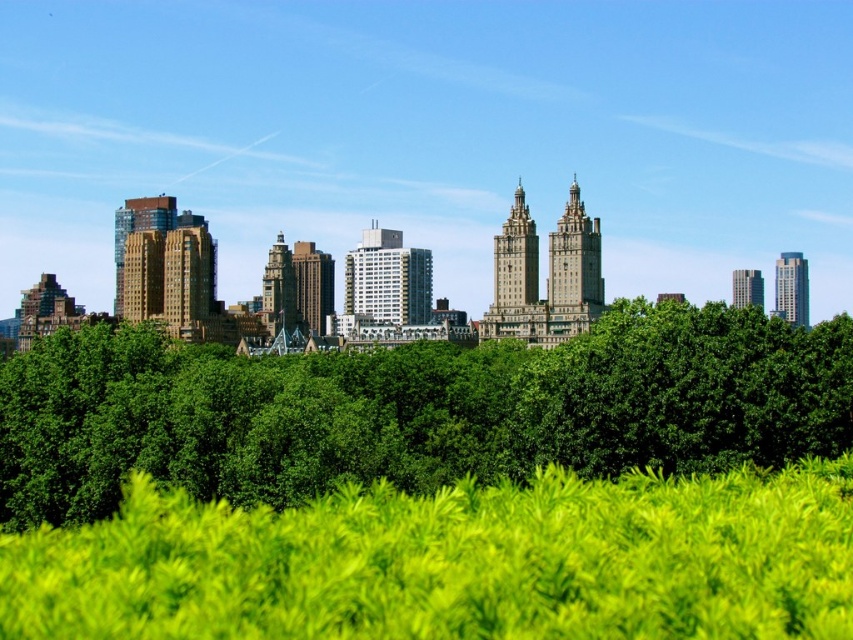
You are a photographer standing at the edge of the park, and you want to capture the green leafy trees at center in your photo. The camera you are using has a maximum focusing distance of 500 meters. Will the trees be in focus?

The green leafy trees at center and camera are 513.34 meters apart, which exceeds the camera maximum focusing distance of 500 meters. Therefore, the trees will not be in focus.

You are standing in the vibrant urban landscape scene. You notice two points marked in the image. The first point is at coordinate point (198, 387) and the second point is at coordinate point (819, 483). Which point is closer to you?

Point (819, 483) is closer to you because point (198, 387) is behind it.

You are a landscape architect designing a new park. You need to place a 10 meter wide walkway between the green leafy trees at center and the green leafy grass at center. Is there enough space between them?

The distance between the green leafy trees at center and the green leafy grass at center is 38.46 meters. Since the walkway only requires 10 meters, there is sufficient space to place it between them.